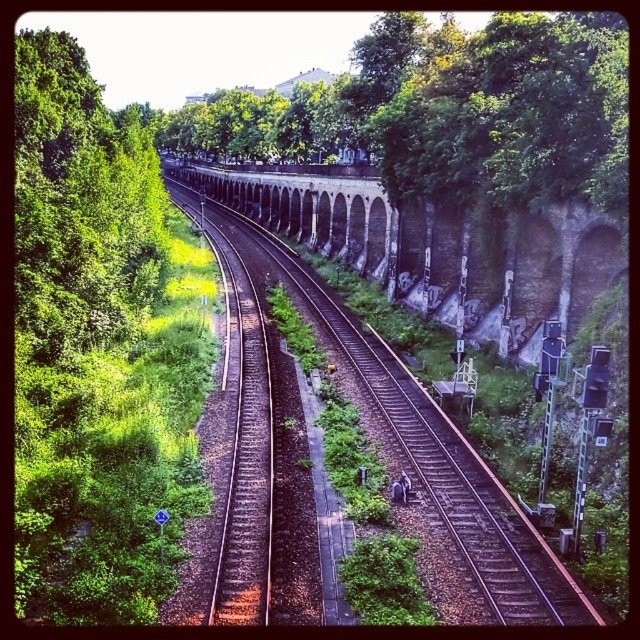
Does green leafy tree at left have a lesser width compared to brown gravel train track at center?

In fact, green leafy tree at left might be wider than brown gravel train track at center.

Find the location of a particular element. The height and width of the screenshot is (640, 640). green leafy tree at left is located at coordinates (99, 352).

Which is in front, point (116, 116) or point (236, 252)?

Point (116, 116) is in front.

Where is `green leafy tree at left`? green leafy tree at left is located at coordinates (99, 352).

Is green leafy tree at left smaller than green leafy tree at center?

Yes.

Is green leafy tree at left in front of green leafy tree at center?

Yes, it is in front of green leafy tree at center.

Locate an element on the screen. The width and height of the screenshot is (640, 640). green leafy tree at left is located at coordinates (99, 352).

Does green leafy tree at center have a greater width compared to brown gravel train track at center?

Yes.

Who is more forward, (552, 49) or (244, 481)?

Positioned in front is point (244, 481).

At what (x,y) coordinates should I click in order to perform the action: click on green leafy tree at center. Please return your answer as a coordinate pair (x, y). Looking at the image, I should click on (449, 109).